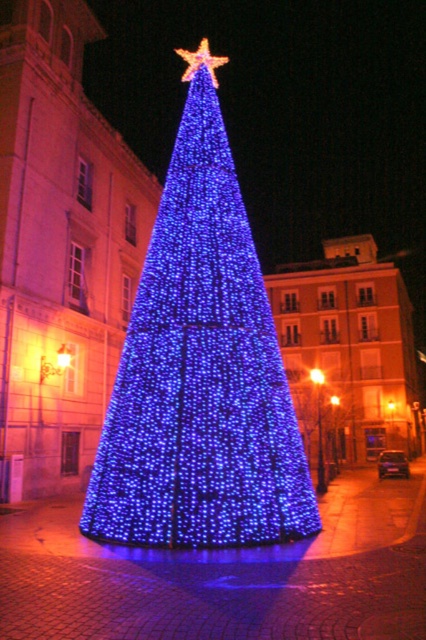
You are a GUI agent. You are given a task and a screenshot of the screen. Output one action in this format:
    pyautogui.click(x=<x>, y=<y>)
    Task: Click on the gold metallic star at upper center
    
    Given the screenshot: What is the action you would take?
    pyautogui.click(x=201, y=61)

Who is more forward, (189, 52) or (319, 374)?

Point (189, 52) is more forward.

Who is more forward, [181,77] or [311,380]?

Point [311,380]

Find the location of a particular element. The height and width of the screenshot is (640, 426). gold metallic star at upper center is located at coordinates (201, 61).

Does blue led lights at center have a greater height compared to gold metallic star at upper center?

No, blue led lights at center is not taller than gold metallic star at upper center.

Which is more to the left, blue led lights at center or gold metallic star at upper center?

Positioned to the left is gold metallic star at upper center.

Is point (123, 364) in front of point (189, 54)?

Yes.

Identify the location of blue led lights at center. This screenshot has width=426, height=640. (199, 374).

Consider the image. Does blue led lights at center appear over bright orange light at center?

Yes, blue led lights at center is above bright orange light at center.

Is point (147, 280) positioned before point (316, 374)?

Yes, point (147, 280) is closer to viewer.

Image resolution: width=426 pixels, height=640 pixels. In order to click on blue led lights at center in this screenshot , I will do `click(199, 374)`.